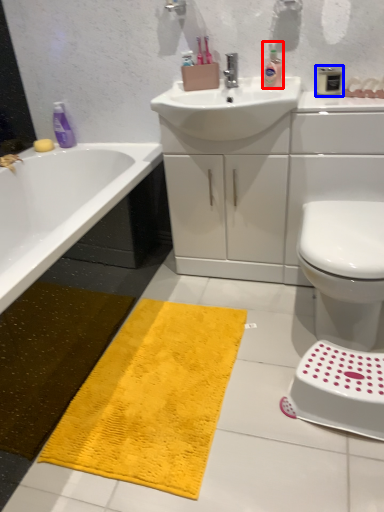
Question: Among these objects, which one is farthest to the camera, cleaning product (highlighted by a red box) or mouthwash (highlighted by a blue box)?

Choices:
 (A) cleaning product
 (B) mouthwash

Answer: (A)